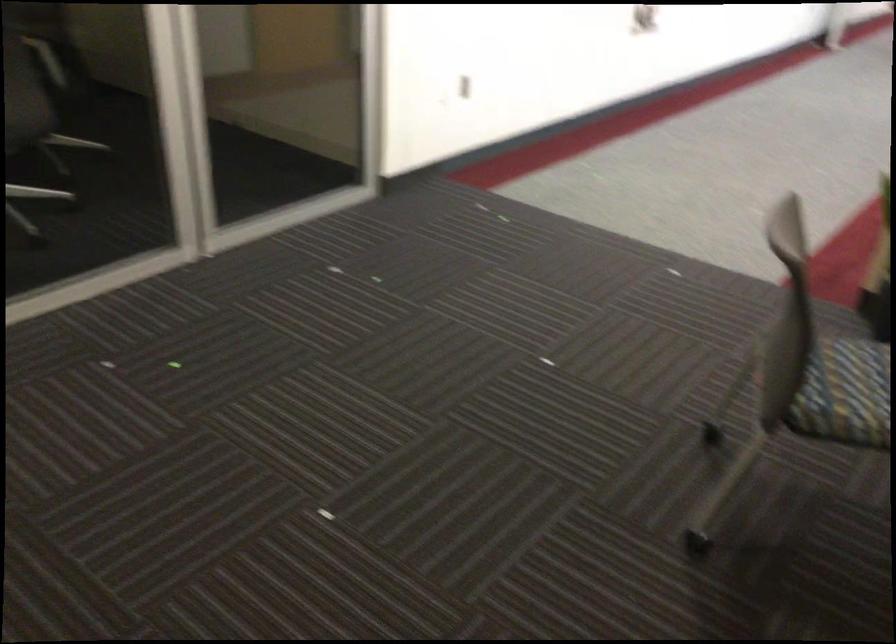
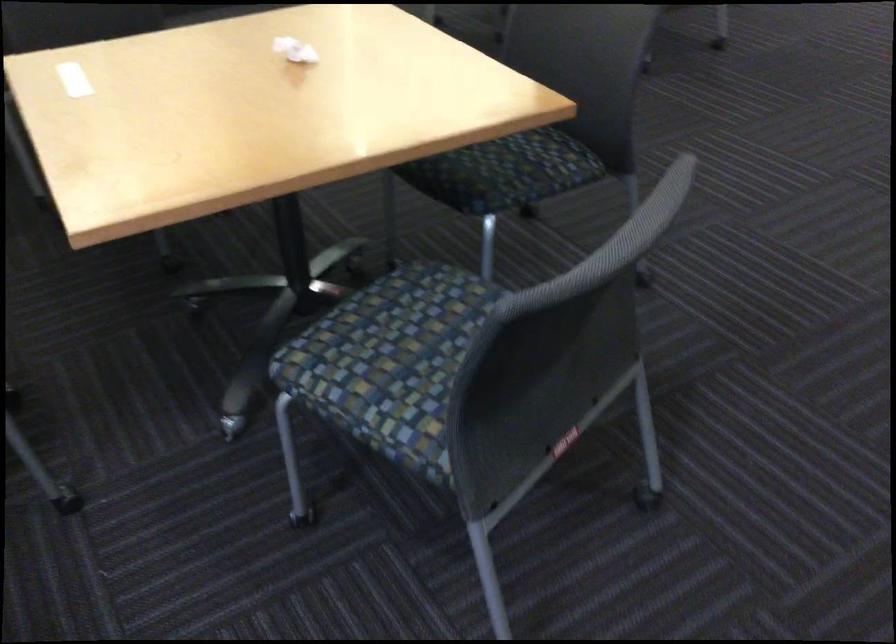
Question: I am providing you with two images of the same scene from different viewpoints. Please identify which objects are invisible in image2.

Choices:
 (A) chair sitting surface
 (B) crumpled white paper
 (C) woven pen holder
 (D) patterned chair sitting surface

Answer: (D)